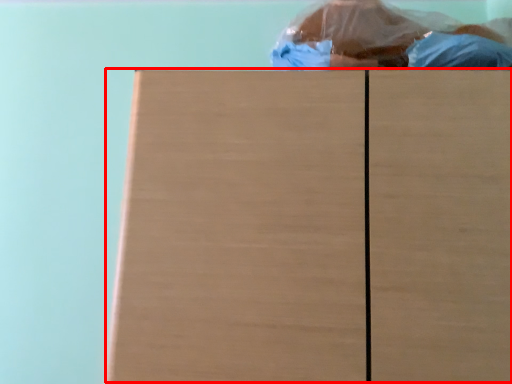
Question: From the image's perspective, where is wood (annotated by the red box) located in relation to person in the image?

Choices:
 (A) above
 (B) below

Answer: (B)